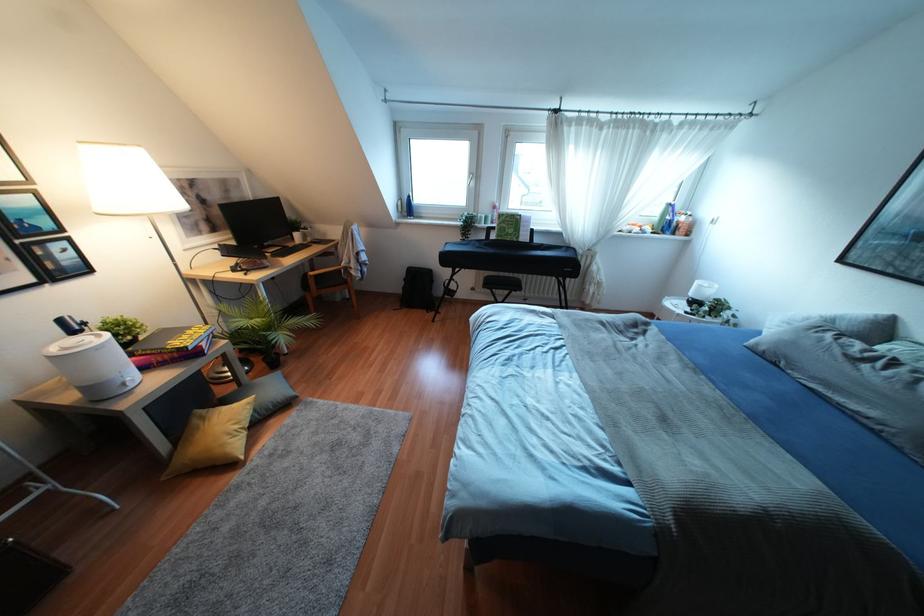
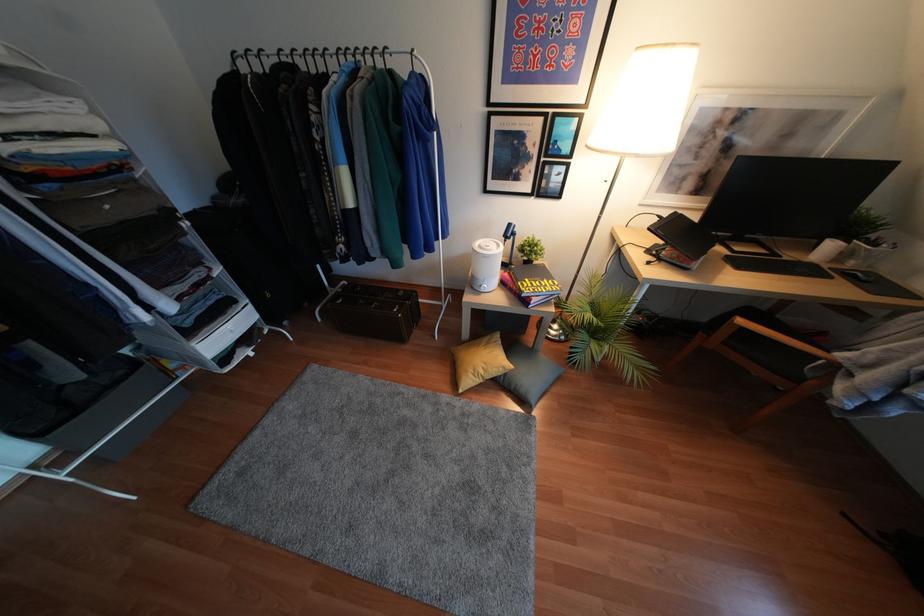
Find the pixel in the second image that matches point (237, 477) in the first image.

(445, 397)